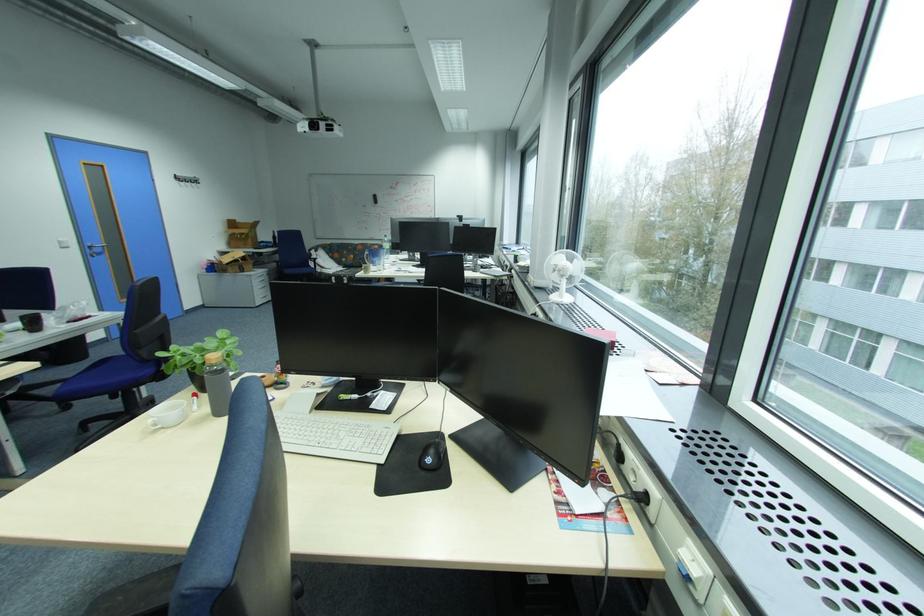
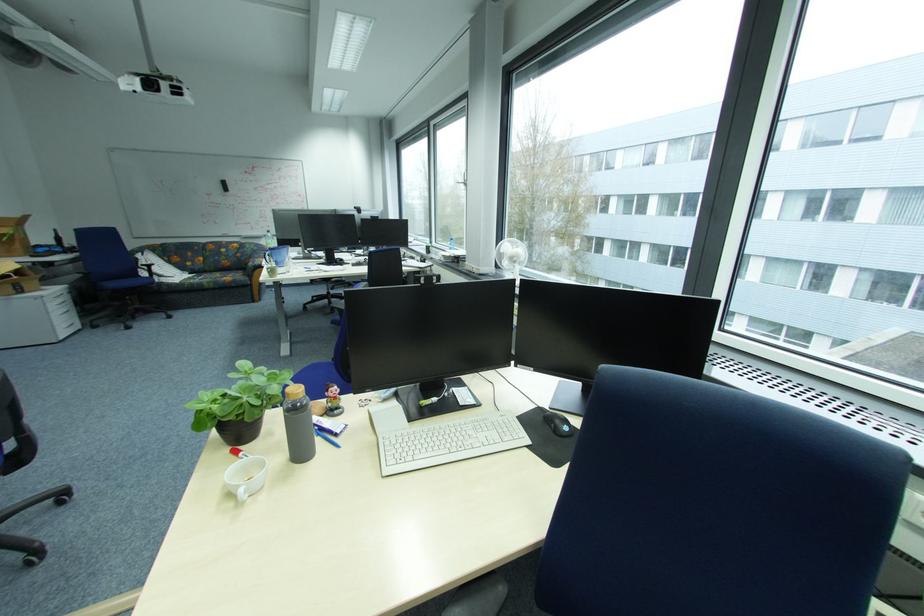
Where in the second image is the point corresponding to (x=298, y=273) from the first image?

(120, 286)